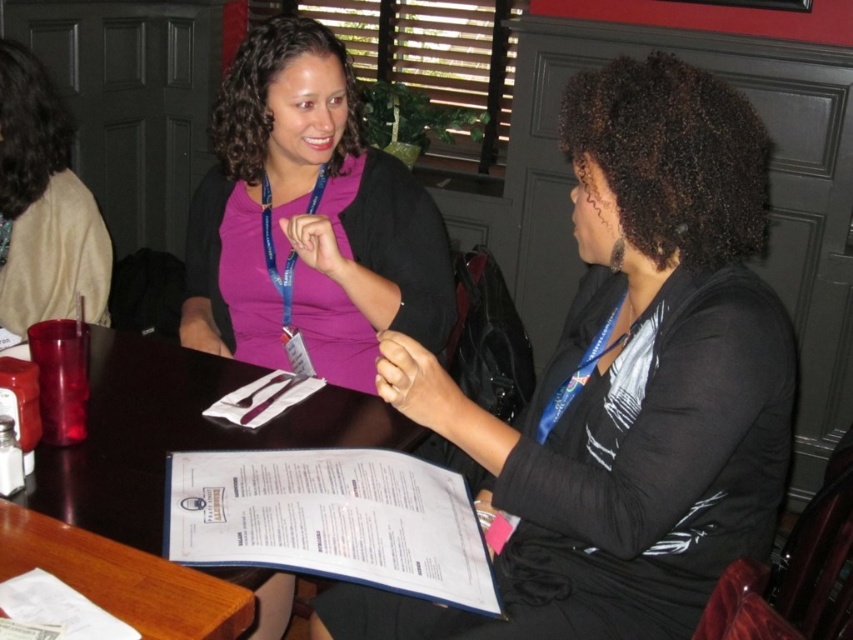
You are a server approaching the table where the two women are seated. You need to place a new menu on the table. Where should you place it so that it is in front of the white paper menu at center but still on the wooden table at lower left?

The wooden table at lower left is behind the white paper menu at center, so to place the new menu in front of the white paper menu at center while keeping it on the wooden table at lower left, position it between the two objects.

Looking at this image, you are a server at a restaurant and need to place a 10 cm tall water glass on the table between the matte black jacket at center and the white paper menu at center. Which object should you place it closer to so that it doesn

The matte black jacket at center is taller than the white paper menu at center, so placing the water glass closer to the white paper menu at center will provide more space around the taller jacket.